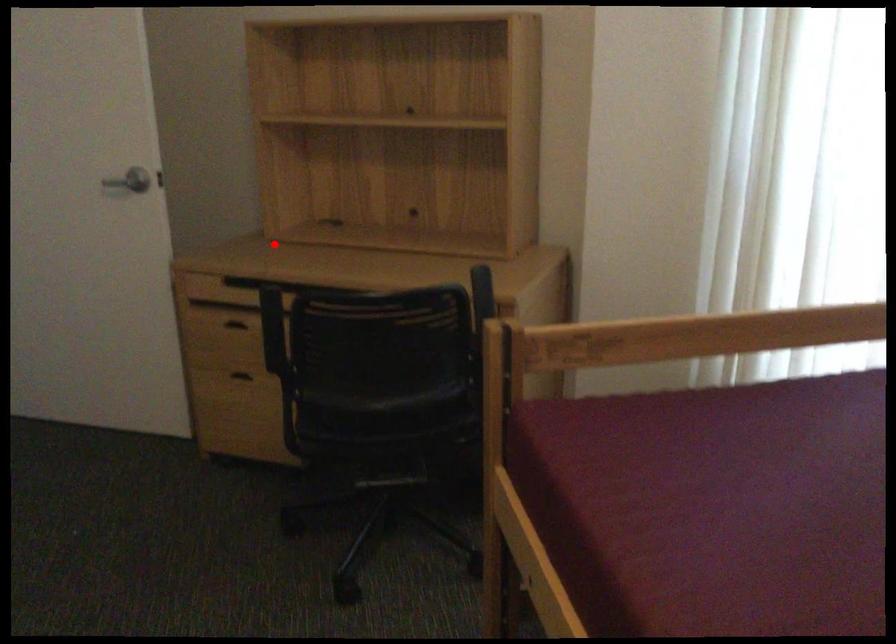
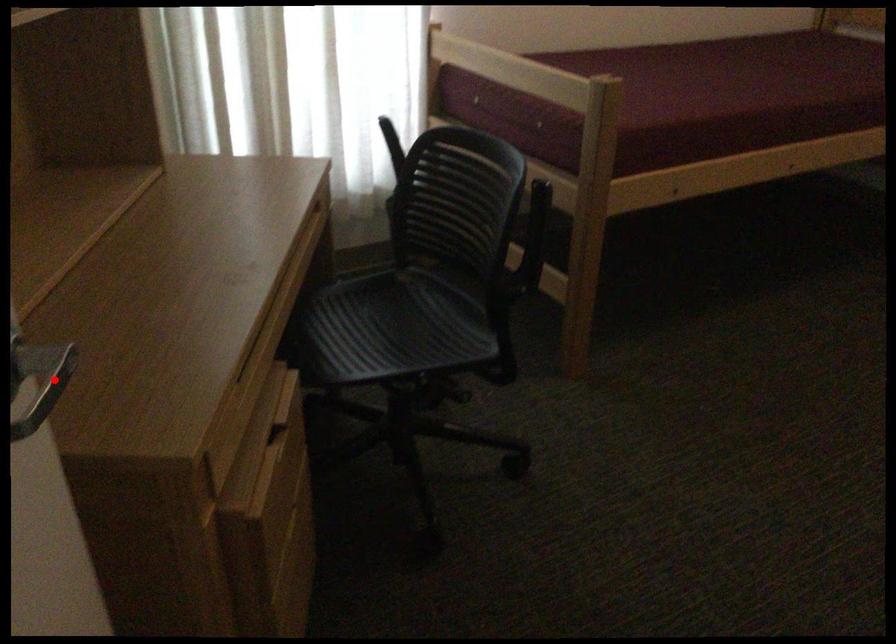
I am providing you with two images of the same scene from different viewpoints. A red point is marked on the first image and another point is marked on the second image. Do the highlighted points in image1 and image2 indicate the same real-world spot?

Yes